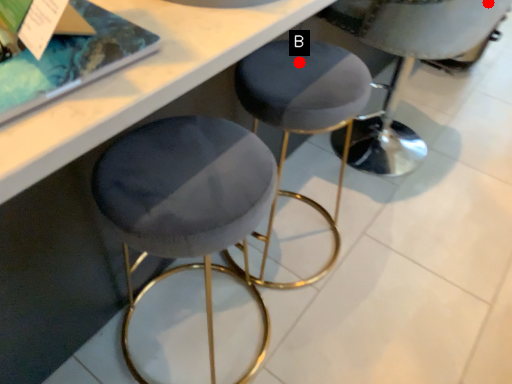
Question: Two points are circled on the image, labeled by A and B beside each circle. Which point appears closest to the camera in this image?

Choices:
 (A) A is closer
 (B) B is closer

Answer: (B)